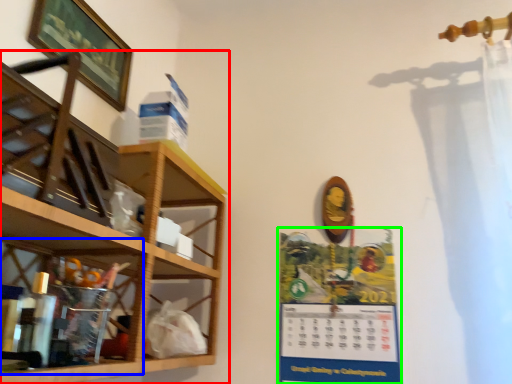
Question: Which object is the farthest from shelf (highlighted by a red box)? Choose among these: cabinet (highlighted by a blue box) or poster page (highlighted by a green box).

Choices:
 (A) cabinet
 (B) poster page

Answer: (B)